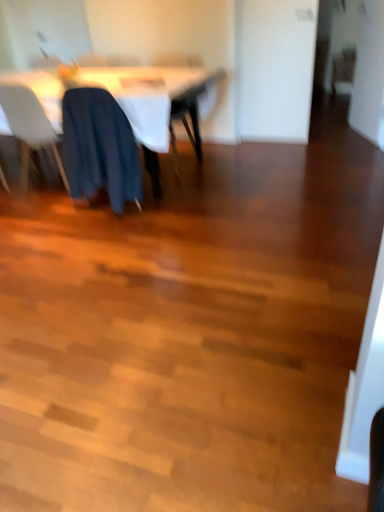
Locate an element on the screen. This screenshot has height=512, width=384. vacant space in front of dark blue fabric at center, the fourth chair viewed from the back is located at coordinates (95, 229).